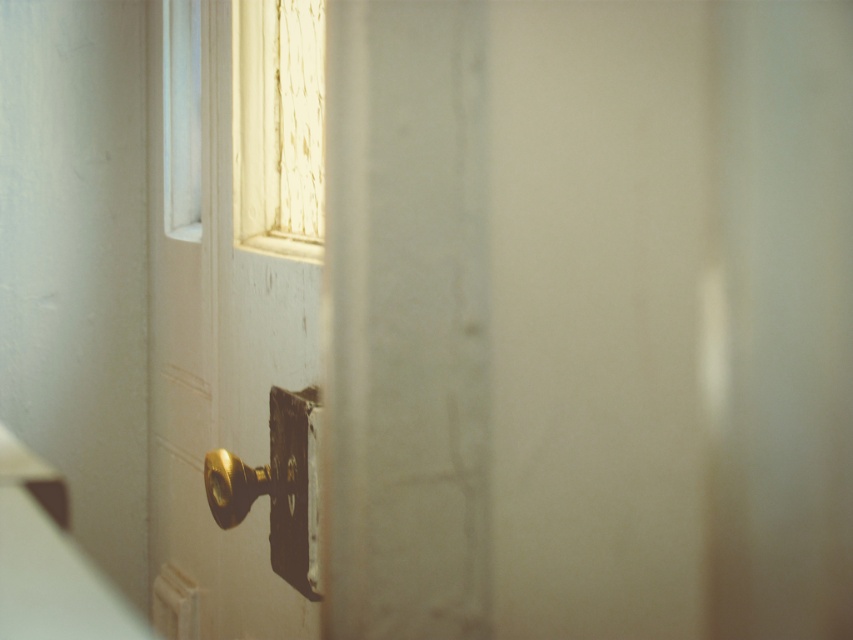
Question: Does white matte door handle at center come in front of gold polished metal door handle at center?

Choices:
 (A) yes
 (B) no

Answer: (B)

Question: Estimate the real-world distances between objects in this image. Which object is closer to the white matte door handle at center?

Choices:
 (A) wooden textured window at upper left
 (B) gold polished metal door handle at center

Answer: (A)

Question: Which of the following is the farthest from the observer?

Choices:
 (A) (281, 556)
 (B) (157, 342)

Answer: (B)

Question: Among these points, which one is nearest to the camera?

Choices:
 (A) (289, 582)
 (B) (231, 218)

Answer: (A)

Question: Does wooden textured window at upper left have a larger size compared to gold polished metal door handle at center?

Choices:
 (A) no
 (B) yes

Answer: (B)

Question: Does wooden textured window at upper left have a larger size compared to gold polished metal door handle at center?

Choices:
 (A) no
 (B) yes

Answer: (B)